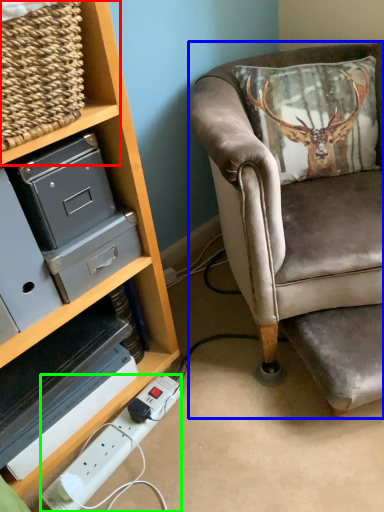
Question: Considering the real-world distances, which object is farthest from shelf (highlighted by a red box)? chair (highlighted by a blue box) or extension cord (highlighted by a green box)?

Choices:
 (A) chair
 (B) extension cord

Answer: (B)